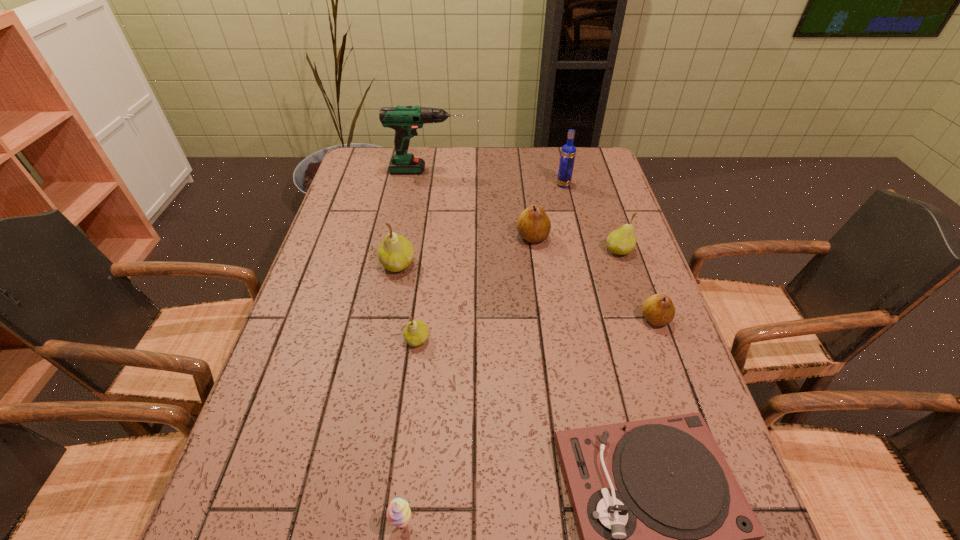
Identify the location of vacant region at the near edge of the desktop. (369, 535).

Identify the location of blank space at the left edge. The image size is (960, 540). (252, 489).

This screenshot has width=960, height=540. In order to click on vacant space at the right edge of the desktop in this screenshot , I will do `click(580, 205)`.

This screenshot has height=540, width=960. What are the coordinates of `free spot between the nearest green pear and the sherbert` in the screenshot? It's located at (410, 431).

You are a GUI agent. You are given a task and a screenshot of the screen. Output one action in this format:
    pyautogui.click(x=<x>, y=<y>)
    Task: Click on the vacant area that lies between the right brown pear and the drill
    Image resolution: width=960 pixels, height=540 pixels.
    Given the screenshot: What is the action you would take?
    pyautogui.click(x=541, y=245)

Where is `free space between the vodka and the bigger brown pear`? free space between the vodka and the bigger brown pear is located at coordinates (548, 211).

Find the location of `free space between the third pear from left to right and the sherbert`. free space between the third pear from left to right and the sherbert is located at coordinates (468, 380).

This screenshot has height=540, width=960. Identify the location of free space between the sherbert and the nearest green pear. (410, 431).

You are a GUI agent. You are given a task and a screenshot of the screen. Output one action in this format:
    pyautogui.click(x=<x>, y=<y>)
    Task: Click on the vacant space in between the second farthest object and the second green pear from right to left
    This screenshot has height=540, width=960.
    Given the screenshot: What is the action you would take?
    pyautogui.click(x=491, y=262)

This screenshot has width=960, height=540. I want to click on blank region between the farther brown pear and the tallest pear, so click(x=466, y=251).